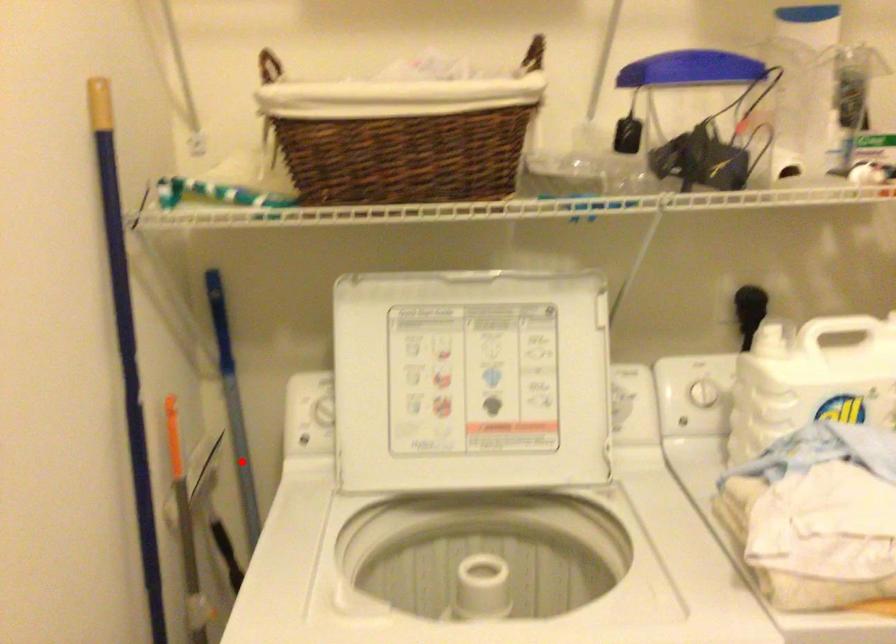
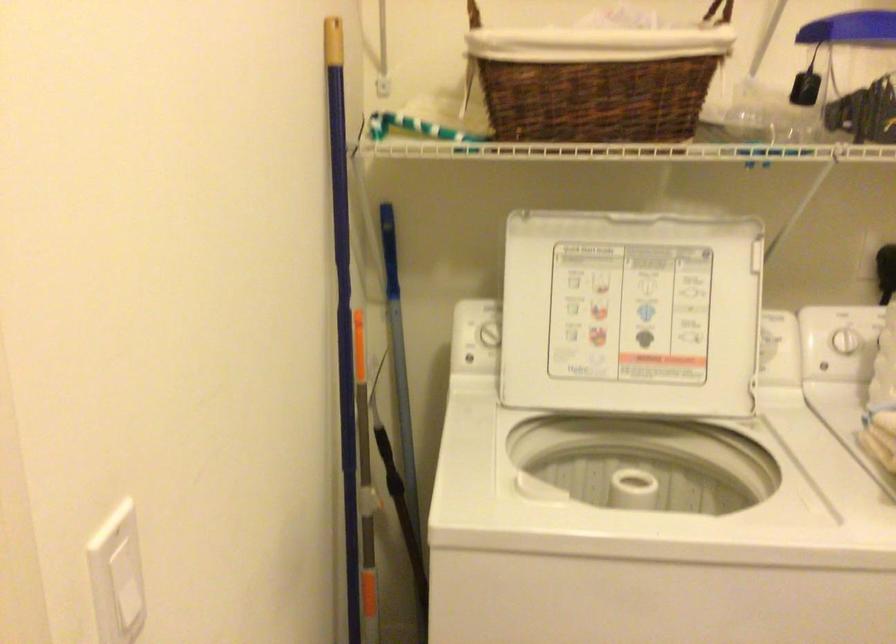
Question: A red point is marked in image1. In image2, is the corresponding 3D point closer to the camera or farther? Reply with the corresponding letter.

Choices:
 (A) The corresponding 3D point is closer.
 (B) The corresponding 3D point is farther.

Answer: (B)